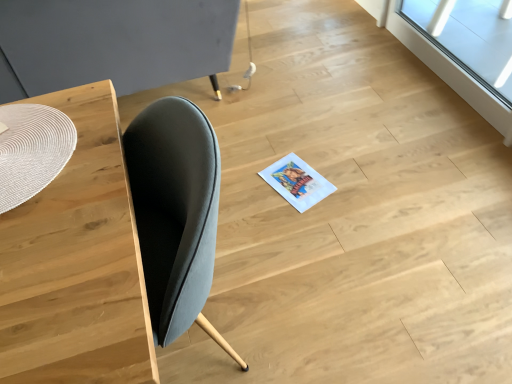
What do you see at coordinates (77, 263) in the screenshot? This screenshot has width=512, height=384. I see `wooden table at left` at bounding box center [77, 263].

What do you see at coordinates (112, 43) in the screenshot? I see `matte woven placemat at left, the 2th round table positioned from the bottom` at bounding box center [112, 43].

What do you see at coordinates (32, 150) in the screenshot? The image size is (512, 384). I see `white woven placemat at left, which appears as the 1th round table when ordered from the bottom` at bounding box center [32, 150].

Find the location of a particular element. Image resolution: width=512 pixels, height=384 pixels. transparent glass window at upper right is located at coordinates (470, 39).

Does wooden table at left have a greater height compared to transparent glass window at upper right?

Yes.

From the picture: Is transparent glass window at upper right a part of wooden table at left?

No, transparent glass window at upper right is not surrounded by wooden table at left.

Is the surface of wooden table at left in direct contact with transparent glass window at upper right?

No, wooden table at left is not beside transparent glass window at upper right.

Which is more to the right, wooden table at left or transparent glass window at upper right?

From the viewer's perspective, transparent glass window at upper right appears more on the right side.

Between white woven placemat at left, which is the 1th round table in front-to-back order, and transparent glass window at upper right, which one is positioned behind?

transparent glass window at upper right is behind.

Would you say white woven placemat at left, which appears as the 1th round table when ordered from the bottom, is inside or outside transparent glass window at upper right?

white woven placemat at left, which appears as the 1th round table when ordered from the bottom, is not inside transparent glass window at upper right, it's outside.

Are white woven placemat at left, the second round table in the top-to-bottom sequence, and transparent glass window at upper right located far from each other?

white woven placemat at left, the second round table in the top-to-bottom sequence, is far away from transparent glass window at upper right.

Considering the relative positions of transparent glass window at upper right and white woven placemat at left, the second round table in the back-to-front sequence, in the image provided, is transparent glass window at upper right behind white woven placemat at left, the second round table in the back-to-front sequence,?

Yes, it is behind white woven placemat at left, the second round table in the back-to-front sequence.

From the image's perspective, would you say transparent glass window at upper right is positioned over white woven placemat at left, the second round table in the back-to-front sequence?

Yes, from the image's perspective, transparent glass window at upper right is above white woven placemat at left, the second round table in the back-to-front sequence.

Is transparent glass window at upper right next to white woven placemat at left, which is the 1th round table in front-to-back order?

No, transparent glass window at upper right is not in contact with white woven placemat at left, which is the 1th round table in front-to-back order.

Locate an element on the screen. the 1st round table counting from the left side of the wooden table at left is located at coordinates (32, 150).

Considering the positions of objects white woven placemat at left, which is the 1th round table in front-to-back order, and wooden table at left in the image provided, who is behind, white woven placemat at left, which is the 1th round table in front-to-back order, or wooden table at left?

white woven placemat at left, which is the 1th round table in front-to-back order, is further away from the camera.

Is white woven placemat at left, the second round table in the back-to-front sequence, spatially inside wooden table at left, or outside of it?

white woven placemat at left, the second round table in the back-to-front sequence, exists entirely within wooden table at left.

Can you confirm if white woven placemat at left, which appears as the 1th round table when ordered from the bottom, is taller than matte woven placemat at left, which is the 1th round table in top-to-bottom order?

No.

Is point (72, 125) positioned after point (154, 46)?

No, it is in front of (154, 46).

Can you confirm if white woven placemat at left, which appears as the 1th round table when ordered from the bottom, is positioned to the left of matte woven placemat at left, the 2th round table positioned from the bottom?

In fact, white woven placemat at left, which appears as the 1th round table when ordered from the bottom, is to the right of matte woven placemat at left, the 2th round table positioned from the bottom.

The width and height of the screenshot is (512, 384). Identify the location of table on the left of transparent glass window at upper right. point(77,263).

Considering the points (490, 63) and (50, 93), which point is in front, point (490, 63) or point (50, 93)?

The point (50, 93) is closer.

Does transparent glass window at upper right turn towards wooden table at left?

Yes, transparent glass window at upper right is turned towards wooden table at left.

From their relative heights in the image, would you say wooden table at left is taller or shorter than white woven placemat at left, which is the 1th round table in front-to-back order?

wooden table at left is taller than white woven placemat at left, which is the 1th round table in front-to-back order.

In the scene shown: Is wooden table at left positioned with its back to white woven placemat at left, which appears as the 1th round table when ordered from the bottom?

That's not correct — wooden table at left is not looking away from white woven placemat at left, which appears as the 1th round table when ordered from the bottom.

Considering the sizes of wooden table at left and white woven placemat at left, which appears as the 1th round table when ordered from the bottom, in the image, is wooden table at left bigger or smaller than white woven placemat at left, which appears as the 1th round table when ordered from the bottom,?

Considering their sizes, wooden table at left takes up more space than white woven placemat at left, which appears as the 1th round table when ordered from the bottom.

Identify the location of table that appears below the white woven placemat at left, the second round table in the top-to-bottom sequence (from a real-world perspective). The image size is (512, 384). (77, 263).

I want to click on table lying in front of the transparent glass window at upper right, so click(x=77, y=263).

Locate an element on the screen. window located behind the white woven placemat at left, which appears as the 1th round table when ordered from the bottom is located at coordinates (470, 39).

Looking at the image, which one is located further to wooden table at left, transparent glass window at upper right or white woven placemat at left, the second round table in the back-to-front sequence?

transparent glass window at upper right is further to wooden table at left.

From the image, which object appears to be nearer to wooden table at left, transparent glass window at upper right or matte woven placemat at left, the 2th round table positioned from the bottom?

matte woven placemat at left, the 2th round table positioned from the bottom, is closer to wooden table at left.

Which object lies further to the anchor point wooden table at left, matte woven placemat at left, which is the 1th round table in top-to-bottom order, or transparent glass window at upper right?

transparent glass window at upper right lies further to wooden table at left than the other object.

Which object lies nearer to the anchor point matte woven placemat at left, which is the 1th round table in top-to-bottom order, white woven placemat at left, which is the 1th round table in front-to-back order, or wooden table at left?

Based on the image, white woven placemat at left, which is the 1th round table in front-to-back order, appears to be nearer to matte woven placemat at left, which is the 1th round table in top-to-bottom order.

From the picture: When comparing their distances from transparent glass window at upper right, does white woven placemat at left, which is the 1th round table in front-to-back order, or matte woven placemat at left, arranged as the 2th round table when viewed from the front, seem further?

white woven placemat at left, which is the 1th round table in front-to-back order.

From the image, which object appears to be nearer to white woven placemat at left, the second round table in the top-to-bottom sequence, wooden table at left or matte woven placemat at left, the first round table when ordered from back to front?

wooden table at left is closer to white woven placemat at left, the second round table in the top-to-bottom sequence.

Estimate the real-world distances between objects in this image. Which object is closer to matte woven placemat at left, the first round table when ordered from back to front, wooden table at left or transparent glass window at upper right?

Among the two, wooden table at left is located nearer to matte woven placemat at left, the first round table when ordered from back to front.

Estimate the real-world distances between objects in this image. Which object is closer to wooden table at left, white woven placemat at left, the second round table in the back-to-front sequence, or transparent glass window at upper right?

Based on the image, white woven placemat at left, the second round table in the back-to-front sequence, appears to be nearer to wooden table at left.

The width and height of the screenshot is (512, 384). Identify the location of table between matte woven placemat at left, the first round table when ordered from back to front, and transparent glass window at upper right. (77, 263).

You are a GUI agent. You are given a task and a screenshot of the screen. Output one action in this format:
    pyautogui.click(x=<x>, y=<y>)
    Task: Click on the round table between matte woven placemat at left, arranged as the 2th round table when viewed from the front, and wooden table at left from top to bottom
    
    Given the screenshot: What is the action you would take?
    pyautogui.click(x=32, y=150)

The height and width of the screenshot is (384, 512). I want to click on table situated between white woven placemat at left, which appears as the 1th round table when ordered from the bottom, and transparent glass window at upper right from left to right, so click(77, 263).

Find the location of a particular element. This screenshot has width=512, height=384. round table situated between matte woven placemat at left, the 2th round table positioned from the bottom, and transparent glass window at upper right from left to right is located at coordinates (32, 150).